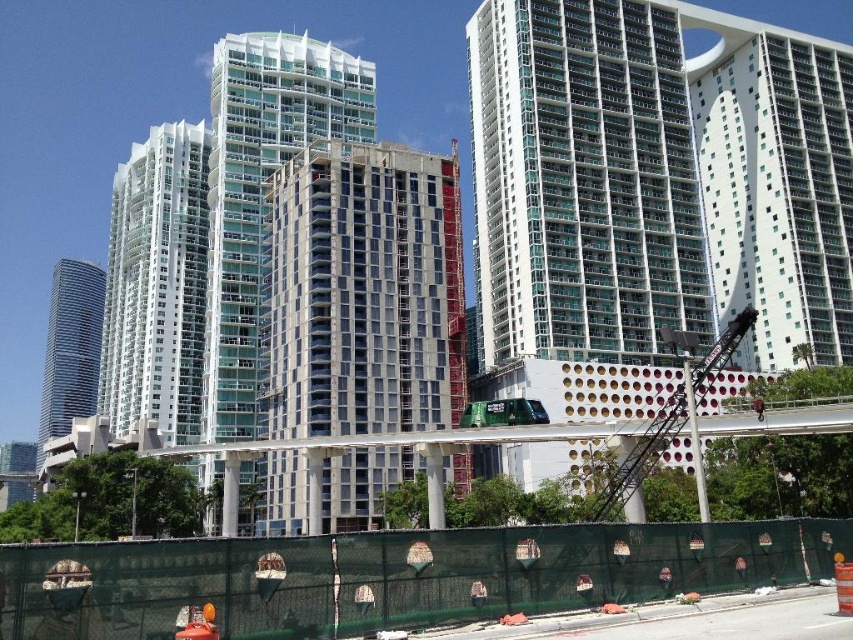
Is white concrete building at center to the right of shiny silver skyscraper at left from the viewer's perspective?

Correct, you'll find white concrete building at center to the right of shiny silver skyscraper at left.

Between white concrete building at center and shiny silver skyscraper at left, which one has less height?

Standing shorter between the two is white concrete building at center.

The height and width of the screenshot is (640, 853). What do you see at coordinates (363, 292) in the screenshot?
I see `white concrete building at center` at bounding box center [363, 292].

Locate an element on the screen. Image resolution: width=853 pixels, height=640 pixels. white concrete building at center is located at coordinates (363, 292).

Can you confirm if transparent glass building at upper right is wider than shiny silver skyscraper at left?

No.

Can you confirm if transparent glass building at upper right is positioned below shiny silver skyscraper at left?

No, transparent glass building at upper right is not below shiny silver skyscraper at left.

This screenshot has height=640, width=853. In order to click on transparent glass building at upper right in this screenshot , I will do `click(582, 180)`.

Who is shorter, transparent glass building at upper right or white concrete building at center?

white concrete building at center is shorter.

Who is higher up, transparent glass building at upper right or white concrete building at center?

transparent glass building at upper right is above.

Between point (520, 163) and point (267, 364), which one is positioned behind?

The point (520, 163) is behind.

Locate an element on the screen. This screenshot has height=640, width=853. transparent glass building at upper right is located at coordinates (582, 180).